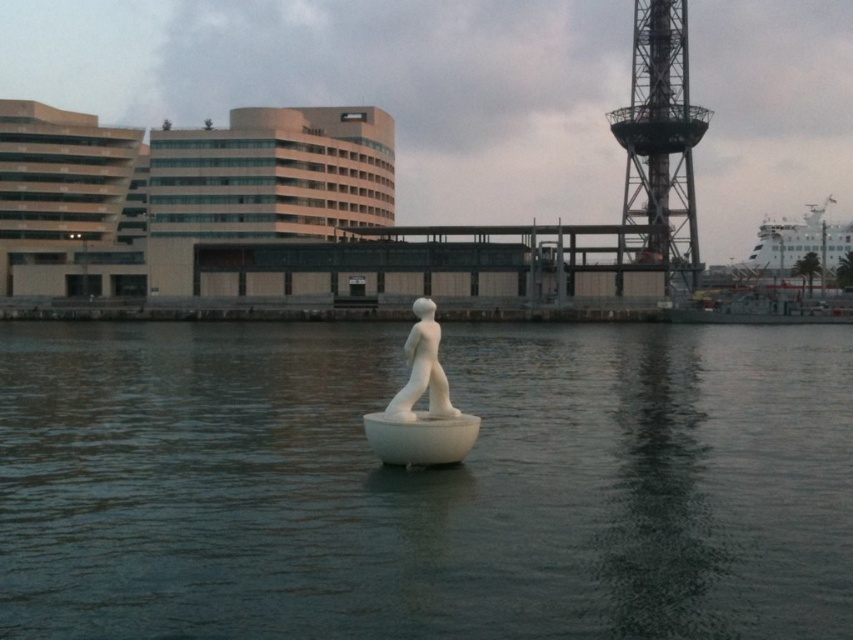
Is white matte water at center smaller than white matte sculpture at center?

Incorrect, white matte water at center is not smaller in size than white matte sculpture at center.

Is white matte water at center positioned before white matte sculpture at center?

Yes, white matte water at center is closer to the viewer.

Who is more forward, (22, 586) or (412, 307)?

Point (22, 586) is more forward.

I want to click on white matte water at center, so click(424, 484).

Which of these two, white glossy ship at upper right or white matte sculpture at center, stands taller?

white glossy ship at upper right

Is point (778, 241) positioned behind point (410, 358)?

Yes, it is behind point (410, 358).

What do you see at coordinates (798, 243) in the screenshot? The height and width of the screenshot is (640, 853). I see `white glossy ship at upper right` at bounding box center [798, 243].

Find the location of a particular element. white glossy ship at upper right is located at coordinates (798, 243).

Does white matte water at center have a larger size compared to white glossy statue at center?

Correct, white matte water at center is larger in size than white glossy statue at center.

From the picture: Is white matte water at center further to camera compared to white glossy statue at center?

No, white matte water at center is in front of white glossy statue at center.

Where is `white matte water at center`? white matte water at center is located at coordinates (424, 484).

Identify the location of white matte water at center. (424, 484).